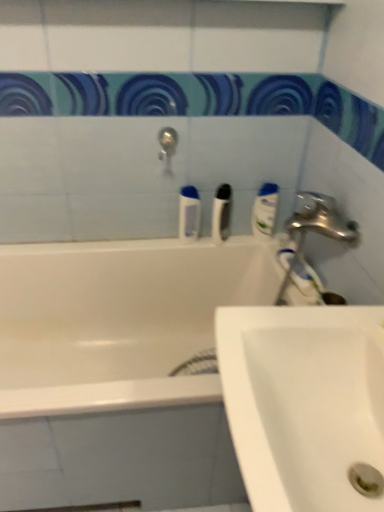
Find the location of a particular element. Image resolution: width=384 pixels, height=512 pixels. free space to the left of white plastic toothbrush at center is located at coordinates (177, 243).